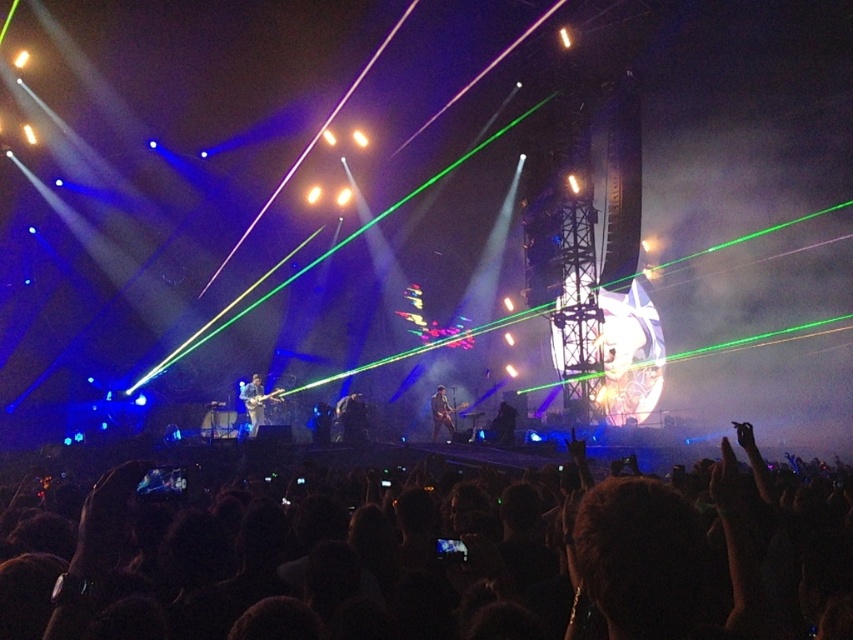
Question: Does black leather guitar at center appear over black fabric at center?

Choices:
 (A) yes
 (B) no

Answer: (A)

Question: Based on their relative distances, which object is nearer to the black leather guitar at center?

Choices:
 (A) shiny silver guitar at center
 (B) black hair at lower center
 (C) black fabric at center

Answer: (A)

Question: Among these points, which one is nearest to the camera?

Choices:
 (A) (442, 396)
 (B) (248, 429)

Answer: (A)

Question: Observing the image, what is the correct spatial positioning of black hair at lower center in reference to black leather guitar at center?

Choices:
 (A) below
 (B) above

Answer: (A)

Question: Is shiny silver guitar at center wider than shiny black guitar at center?

Choices:
 (A) no
 (B) yes

Answer: (B)

Question: Which point is closer to the camera taking this photo?

Choices:
 (A) (408, 538)
 (B) (495, 429)
 (C) (434, 404)

Answer: (A)